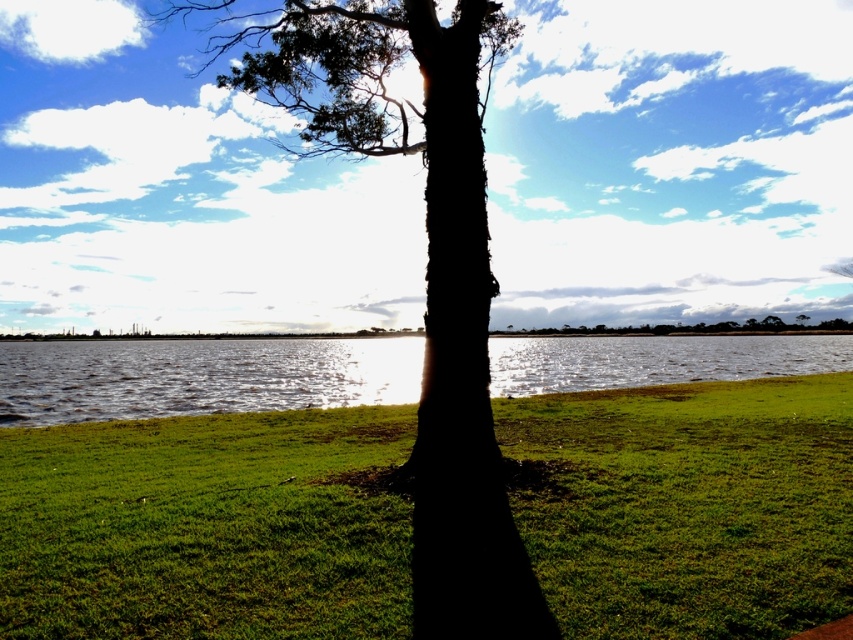
You are standing in the outdoor scene and want to take a photo of the dark bark tree at center. To ensure the tree is the main focus, should you position yourself closer to the green grassy at center or farther away?

To make the dark bark tree at center the main focus in your photo, position yourself closer to the green grassy at center. Since the green grassy at center is not as tall as the dark bark tree at center, moving closer will reduce the size of the grassy area relative to the tree, emphasizing the tree as the central subject.

You are planning to walk from the tree to the water. Which path would require walking a shorter distance, through the green grassy at center or over the glistening water at center? Please explain your reasoning based on the scene description.

The green grassy at center has a smaller width than the glistening water at center, so walking through the green grassy at center would require a shorter distance compared to crossing the glistening water at center.

From the picture: You are standing in the scene and want to walk towards the water. Which object, the green grassy at center or the dark bark tree at center, will you encounter first?

The green grassy at center is in front of the dark bark tree at center, so you will encounter the green grassy at center first.